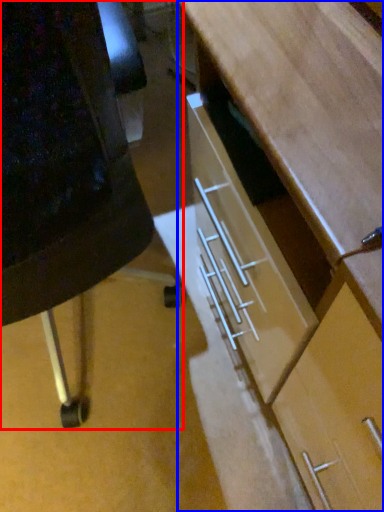
Question: Which point is further to the camera, furniture (highlighted by a red box) or desk (highlighted by a blue box)?

Choices:
 (A) furniture
 (B) desk

Answer: (B)